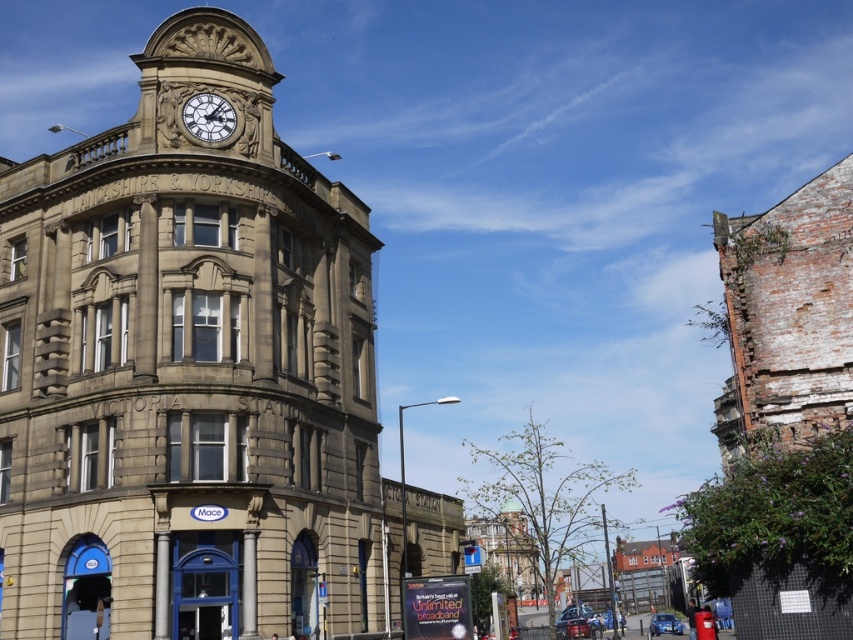
You are an architect inspecting the Victoria Station building. You notice the brown stone clock tower at upper center and the matte stone clock at upper center. Which of these two objects is wider?

The brown stone clock tower at upper center is wider than the matte stone clock at upper center.

You are standing in front of the building and want to take a photo. You notice two points marked on the building facade. Which of the two points, point 1 at coordinates (209, 616) or point 2 at coordinates (196, 108), is closer to your camera lens?

Point 1 at coordinates (209, 616) is closer to the camera lens than point 2 at coordinates (196, 108).